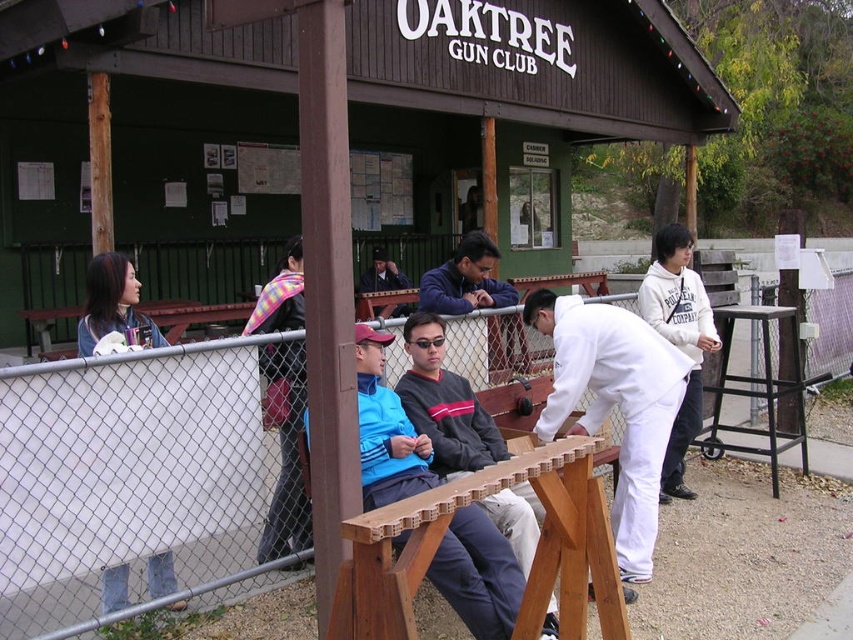
Between leather jacket at center and white fleece sweatshirt at center, which one is positioned higher?

white fleece sweatshirt at center

Between point (283, 509) and point (651, 289), which one is positioned in front?

Point (283, 509) is more forward.

Which is behind, point (293, 515) or point (682, 307)?

The point (682, 307) is behind.

Where is `leather jacket at center`? leather jacket at center is located at coordinates (285, 451).

From the picture: Is leather jacket at center positioned behind matte blue jacket at left?

Yes, it is.

Is point (299, 545) positioned behind point (120, 296)?

Yes, point (299, 545) is behind point (120, 296).

Is point (296, 397) more distant than point (107, 292)?

Yes, point (296, 397) is farther from viewer.

Identify the location of leather jacket at center. The image size is (853, 640). click(x=285, y=451).

Is dark gray sweater at center in front of matte blue jacket at center?

Yes, it is in front of matte blue jacket at center.

Who is positioned more to the left, dark gray sweater at center or matte blue jacket at center?

From the viewer's perspective, matte blue jacket at center appears more on the left side.

Find the location of a particular element. This screenshot has height=640, width=853. dark gray sweater at center is located at coordinates (445, 403).

You are a GUI agent. You are given a task and a screenshot of the screen. Output one action in this format:
    pyautogui.click(x=<x>, y=<y>)
    Task: Click on the dark gray sweater at center
    The width and height of the screenshot is (853, 640).
    Given the screenshot: What is the action you would take?
    tap(445, 403)